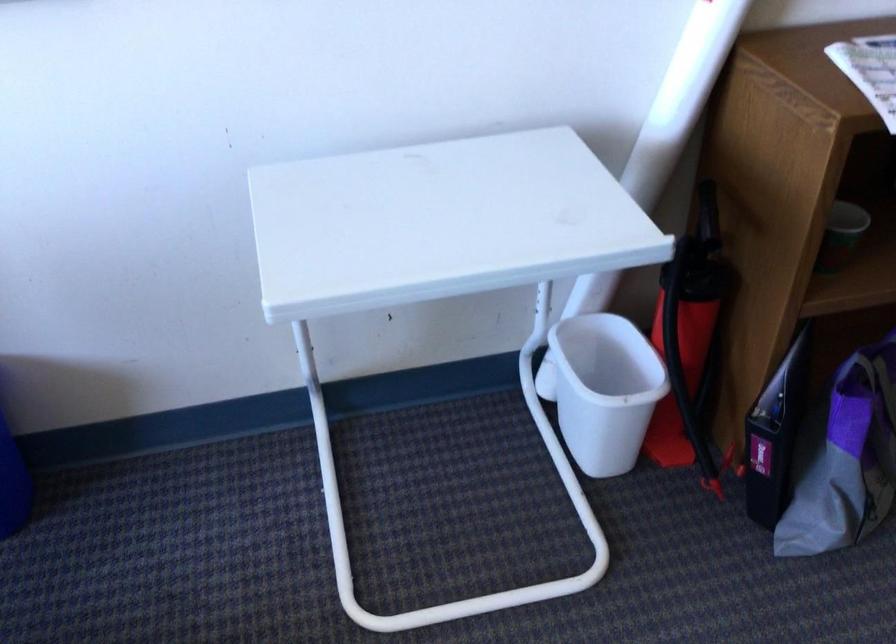
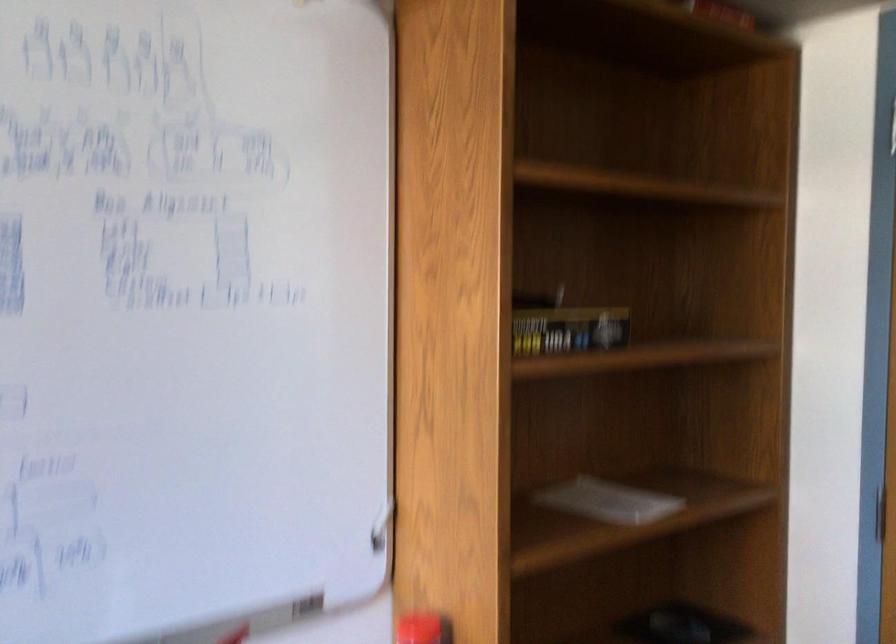
The first image is from the beginning of the video and the second image is from the end. How did the camera likely rotate when shooting the video?

The camera's rotation is toward right-up.